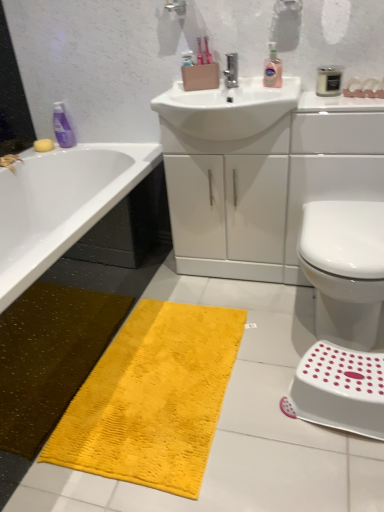
Find the location of a particular element. The image size is (384, 512). vacant area to the right of purple glossy mouthwash at upper left, the second mouthwash in the front-to-back sequence is located at coordinates (100, 144).